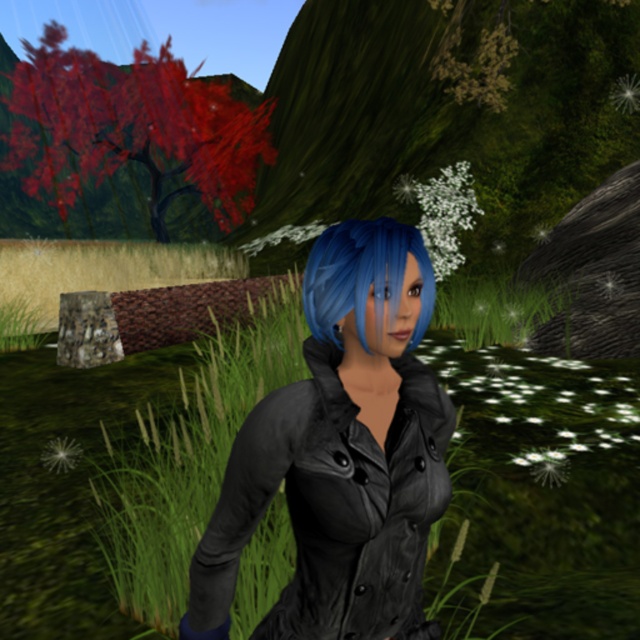
Question: From the image, what is the correct spatial relationship of green matte grass at center in relation to blue matte hair at center?

Choices:
 (A) right
 (B) left

Answer: (B)

Question: Can you confirm if green matte grass at center is smaller than blue matte hair at center?

Choices:
 (A) no
 (B) yes

Answer: (A)

Question: Which point is closer to the camera taking this photo?

Choices:
 (A) (621, 509)
 (B) (141, 86)
 (C) (362, 509)

Answer: (C)

Question: Which object appears closest to the camera in this image?

Choices:
 (A) green matte grass at center
 (B) shiny red tree at upper left
 (C) blue matte hair at center

Answer: (C)

Question: Is shiny red tree at upper left wider than blue matte hair at center?

Choices:
 (A) yes
 (B) no

Answer: (A)

Question: Estimate the real-world distances between objects in this image. Which object is closer to the matte black jacket at center?

Choices:
 (A) shiny red tree at upper left
 (B) blue matte hair at center

Answer: (B)